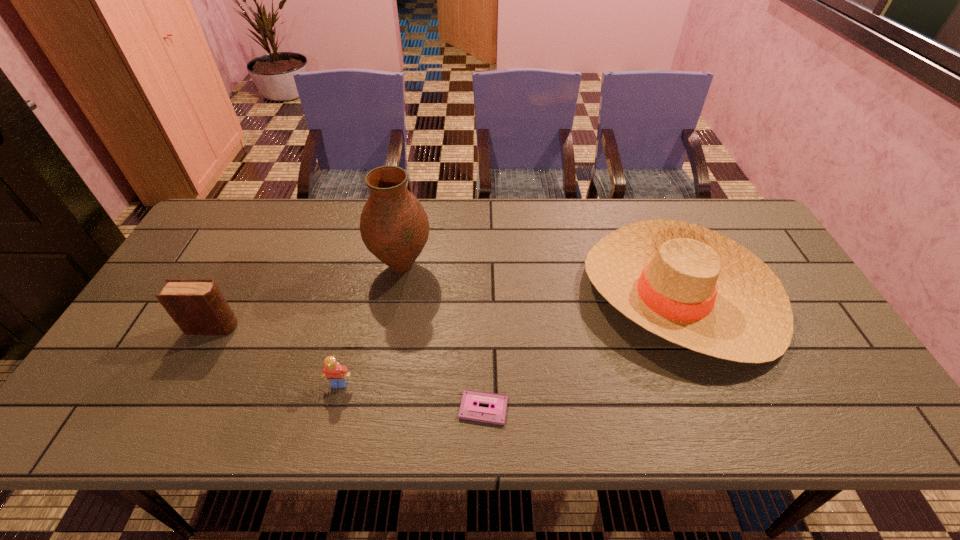
In order to click on free space that is in between the sunhat and the vase in this screenshot , I will do `click(540, 281)`.

Where is `free space between the fourth tallest object and the tallest object`? The width and height of the screenshot is (960, 540). free space between the fourth tallest object and the tallest object is located at coordinates (371, 325).

Identify the location of empty space that is in between the diary and the rightmost object. The height and width of the screenshot is (540, 960). (445, 311).

You are a GUI agent. You are given a task and a screenshot of the screen. Output one action in this format:
    pyautogui.click(x=<x>, y=<y>)
    Task: Click on the free space that is in between the vase and the second nearest object
    
    Given the screenshot: What is the action you would take?
    pyautogui.click(x=371, y=325)

Locate an element on the screen. object that ranks as the third closest to the shortest object is located at coordinates (394, 226).

At what (x,y) coordinates should I click in order to perform the action: click on object that is the fourth closest to the Lego. Please return your answer as a coordinate pair (x, y). Looking at the image, I should click on (692, 286).

The height and width of the screenshot is (540, 960). Find the location of `vacant area that satisfies the following two spatial constraints: 1. on the back side of the videotape; 2. on the spine side of the diary`. vacant area that satisfies the following two spatial constraints: 1. on the back side of the videotape; 2. on the spine side of the diary is located at coordinates (483, 327).

The height and width of the screenshot is (540, 960). Find the location of `vacant point that satisfies the following two spatial constraints: 1. on the front side of the sunhat; 2. on the spine side of the leftmost object`. vacant point that satisfies the following two spatial constraints: 1. on the front side of the sunhat; 2. on the spine side of the leftmost object is located at coordinates (691, 327).

Locate an element on the screen. This screenshot has height=540, width=960. free space that satisfies the following two spatial constraints: 1. on the front-facing side of the second shortest object; 2. on the right side of the videotape is located at coordinates (333, 408).